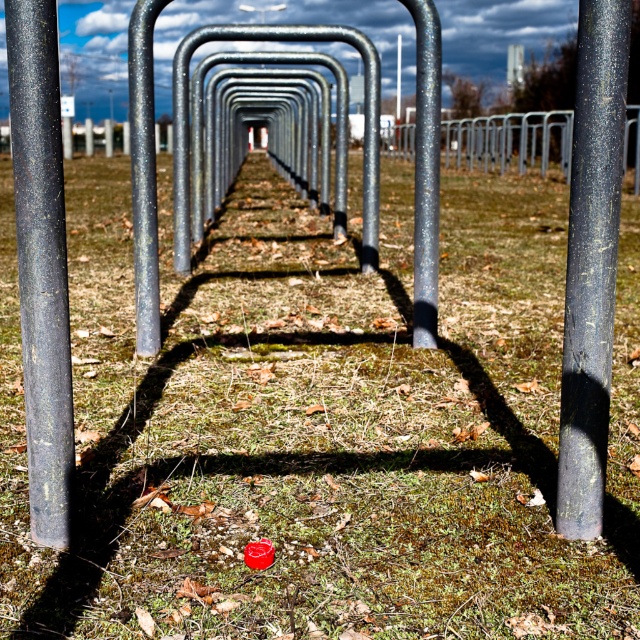
Which is more to the left, glossy metal bike rack at center or glossy metal pole at center?

glossy metal pole at center

Which is below, glossy metal bike rack at center or glossy metal pole at center?

glossy metal pole at center is below.

Is point (368, 243) in front of point (145, 188)?

No, it is behind (145, 188).

Identify the location of glossy metal bike rack at center. (282, 40).

Can you confirm if glossy metal bike rack at center is positioned above galvanized steel pole at center?

Incorrect, glossy metal bike rack at center is not positioned above galvanized steel pole at center.

Which of these two, glossy metal bike rack at center or galvanized steel pole at center, stands shorter?

Standing shorter between the two is galvanized steel pole at center.

Which is in front, point (195, 36) or point (424, 333)?

Point (424, 333) is more forward.

The image size is (640, 640). I want to click on glossy metal bike rack at center, so click(282, 40).

Is point (586, 48) less distant than point (134, 20)?

That is True.

Which of these two, black matte pole at right or glossy metal pole at center, stands taller?

glossy metal pole at center

Does point (596, 470) lie behind point (136, 67)?

That is False.

This screenshot has width=640, height=640. Identify the location of black matte pole at right. (592, 262).